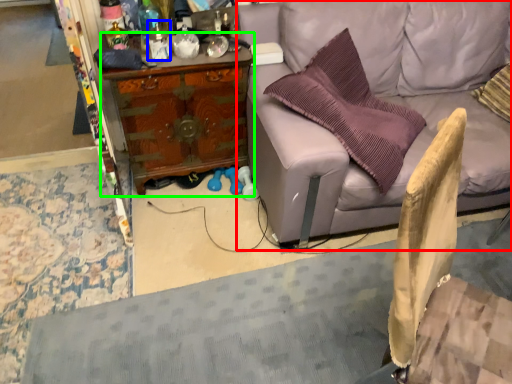
Question: Which object is the closest to the studio couch (highlighted by a red box)? Choose among these: bottle (highlighted by a blue box) or desk (highlighted by a green box).

Choices:
 (A) bottle
 (B) desk

Answer: (B)